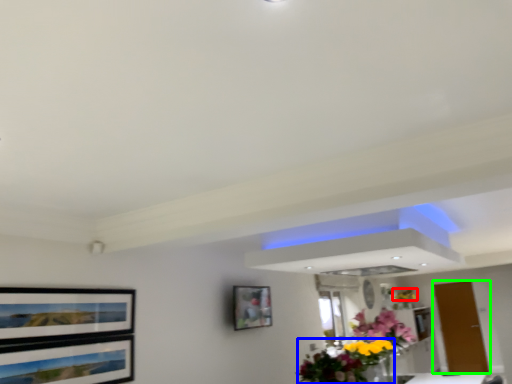
Question: Which object is the farthest from flower (highlighted by a red box)? Choose among these: floral arrangement (highlighted by a blue box) or door (highlighted by a green box).

Choices:
 (A) floral arrangement
 (B) door

Answer: (A)